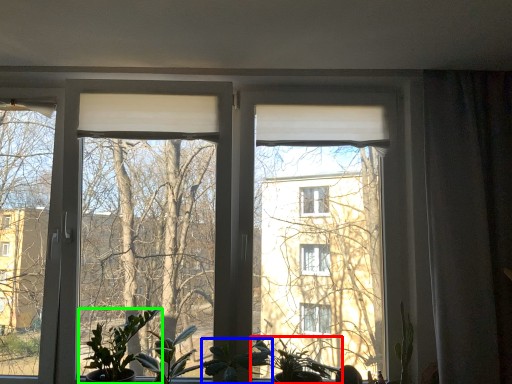
Question: Which is farther away from houseplant (highlighted by a red box)? plant (highlighted by a blue box) or houseplant (highlighted by a green box)?

Choices:
 (A) plant
 (B) houseplant

Answer: (B)